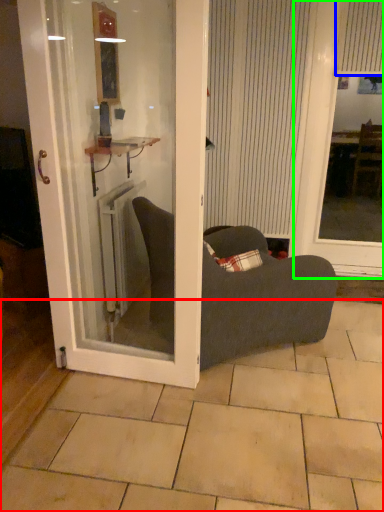
Question: Which object is positioned closest to tile (highlighted by a red box)? Select from curtain (highlighted by a blue box) and window screen (highlighted by a green box).

Choices:
 (A) curtain
 (B) window screen

Answer: (B)